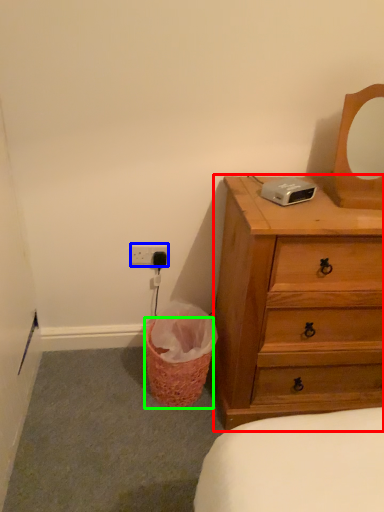
Question: Based on their relative distances, which object is nearer to chest of drawers (highlighted by a red box)? Choose from electric outlet (highlighted by a blue box) and basket (highlighted by a green box).

Choices:
 (A) electric outlet
 (B) basket

Answer: (B)